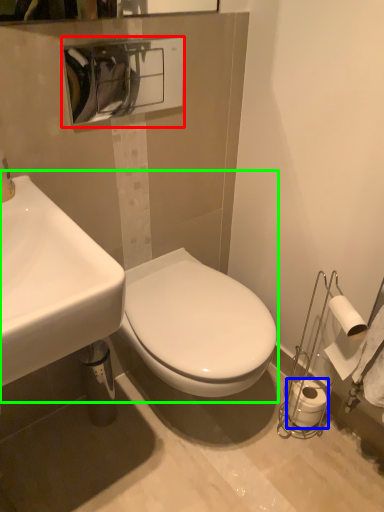
Question: Considering the real-world distances, which object is farthest from hand dryer (highlighted by a red box)? toilet paper (highlighted by a blue box) or sink (highlighted by a green box)?

Choices:
 (A) toilet paper
 (B) sink

Answer: (A)